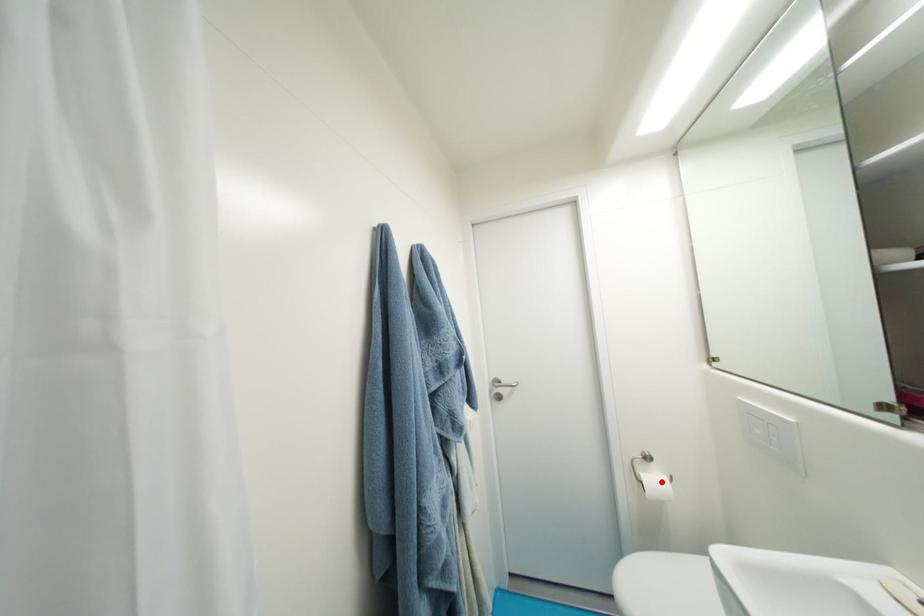
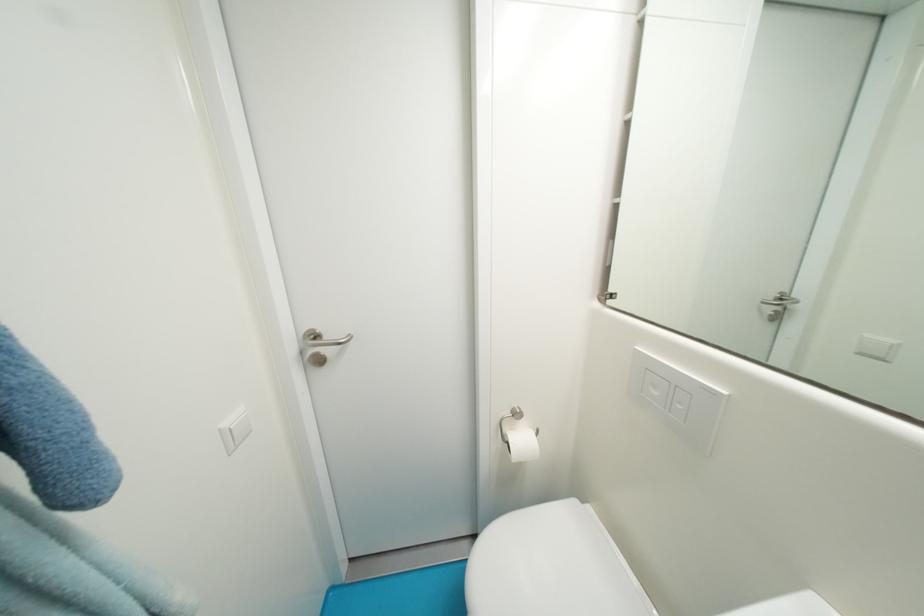
Where in the second image is the point corresponding to the highlighted location from the first image?

(529, 442)